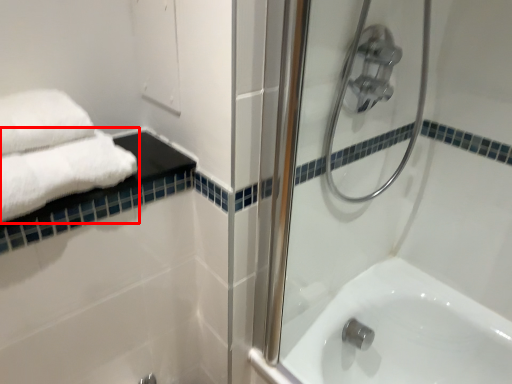
Question: Observing the image, what is the correct spatial positioning of towel (annotated by the red box) in reference to shower door?

Choices:
 (A) right
 (B) left

Answer: (B)